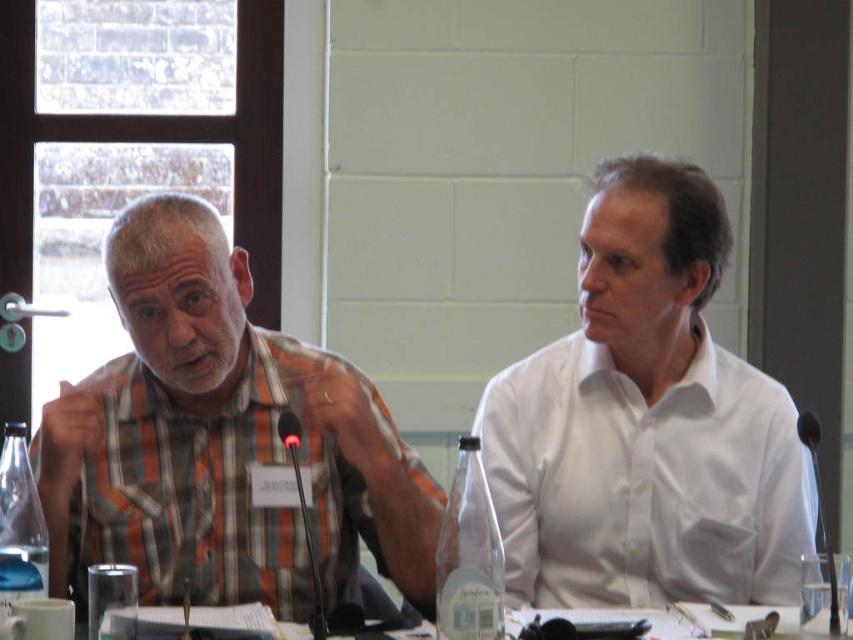
Question: Which of the following is the closest to the observer?

Choices:
 (A) white smooth shirt at center
 (B) plaid shirt at left

Answer: (B)

Question: Which point is farther from the camera taking this photo?

Choices:
 (A) (677, 403)
 (B) (738, 637)
 (C) (78, 445)

Answer: (A)

Question: In this image, where is white smooth shirt at center located relative to clear plastic table at center?

Choices:
 (A) right
 (B) left

Answer: (B)

Question: Does white smooth shirt at center appear under plaid shirt at left?

Choices:
 (A) no
 (B) yes

Answer: (A)

Question: Which object is closer to the camera taking this photo?

Choices:
 (A) clear plastic table at center
 (B) plaid shirt at left

Answer: (B)

Question: Considering the relative positions of plaid shirt at left and clear plastic table at center in the image provided, where is plaid shirt at left located with respect to clear plastic table at center?

Choices:
 (A) below
 (B) above

Answer: (B)